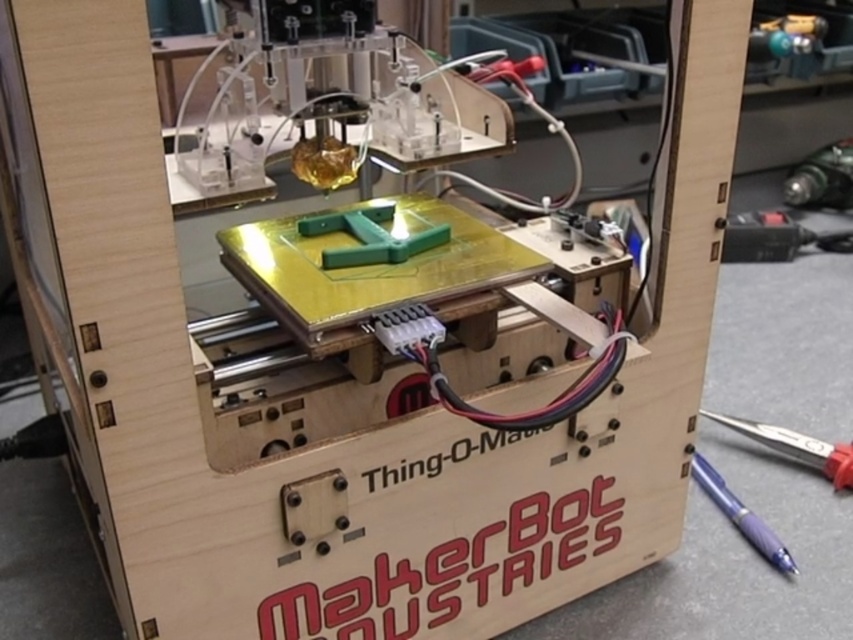
You are an office worker who just received a new 3D printer. You need to place a pen on the desk next to the printer. Which pen, the metallic blue pen at lower right or the purple glossy pen at lower right, is closer to you so you can grab it easily?

The metallic blue pen at lower right is closer to you since the purple glossy pen at lower right is positioned behind it.

You are a technician inspecting the MakerBot Industries 3D printer inside its wooden enclosure. You notice the green matte plastic at center and the purple glossy pen at lower right. Which object is positioned higher in the scene?

The green matte plastic at center is above the purple glossy pen at lower right, so it is positioned higher in the scene.